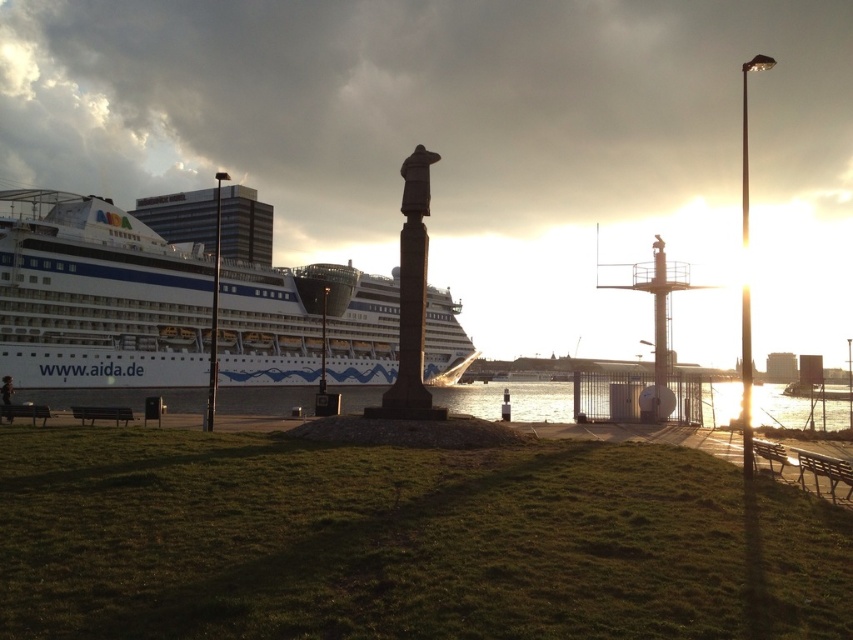
Does brown wooden bench at lower left appear on the left side of wooden bench at lower left?

No, brown wooden bench at lower left is not to the left of wooden bench at lower left.

Who is lower down, brown wooden bench at lower left or wooden bench at lower left?

brown wooden bench at lower left

I want to click on brown wooden bench at lower left, so click(x=102, y=413).

Does brown wooden bench at lower right appear under brown wooden bench at lower left?

No, brown wooden bench at lower right is not below brown wooden bench at lower left.

Between point (813, 474) and point (91, 422), which one is positioned in front?

Point (813, 474)

Measure the distance between point (848, 490) and camera.

They are 27.52 meters apart.

Image resolution: width=853 pixels, height=640 pixels. Find the location of `brown wooden bench at lower right`. brown wooden bench at lower right is located at coordinates (824, 472).

Does brown wooden bench at lower right appear over wooden park bench at lower right?

Yes, brown wooden bench at lower right is above wooden park bench at lower right.

Is point (822, 456) closer to camera compared to point (769, 452)?

That is False.

Which is behind, point (843, 476) or point (770, 458)?

Point (770, 458)

Locate an element on the screen. The width and height of the screenshot is (853, 640). brown wooden bench at lower right is located at coordinates (824, 472).